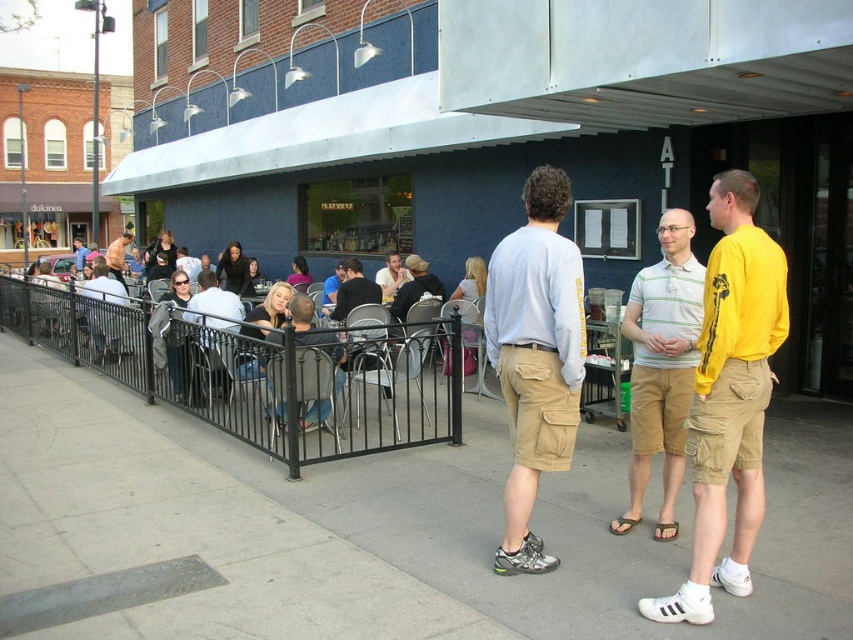
You are a photographer trying to capture a candid shot of the light brown cotton shorts at center and the matte black shirt at center. Since you want to ensure both are in focus, you need to know which one is wider. Which object is narrower?

The light brown cotton shorts at center is narrower than the matte black shirt at center.